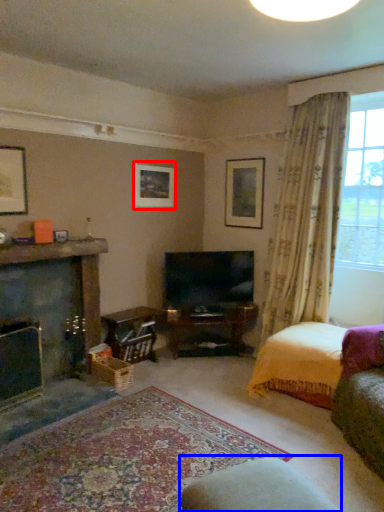
Question: Which point is further to the camera, picture frame (highlighted by a red box) or rocking chair (highlighted by a blue box)?

Choices:
 (A) picture frame
 (B) rocking chair

Answer: (A)